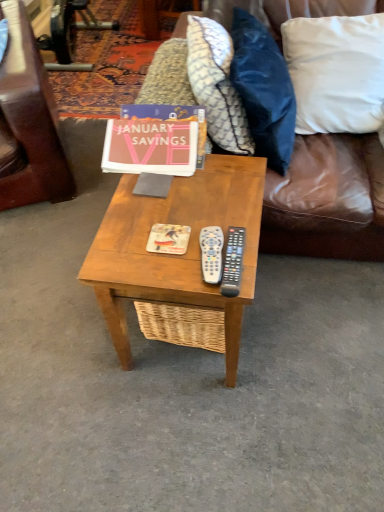
Locate an element on the screen. vacant space behind white plastic remote at center, marked as the second remote in a right-to-left arrangement is located at coordinates (208, 207).